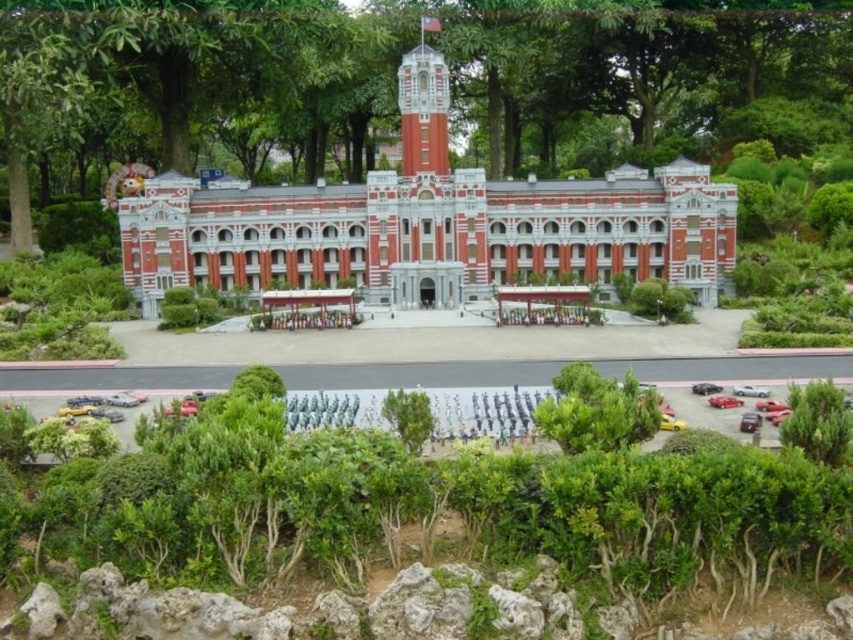
You are a visitor standing in front of the red brick building at center and the red brick clock tower at upper center. Which structure is closer to your right side?

The red brick clock tower at upper center is closer to your right side because the red brick building at center is positioned on the left side of it.

You are standing at the point labeled point (430, 234) in the image. What structure is directly in front of you?

The point labeled point (430, 234) corresponds to the red brick building at center, so the structure directly in front of you is the red brick building at center.